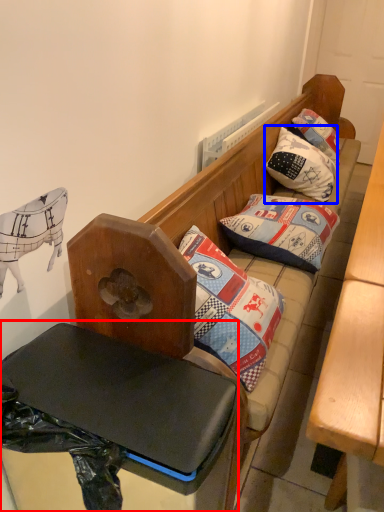
Question: Which of the following is the closest to the observer, table (highlighted by a red box) or pillow (highlighted by a blue box)?

Choices:
 (A) table
 (B) pillow

Answer: (A)